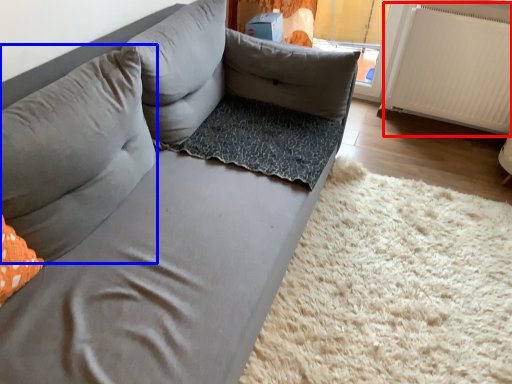
Question: Which of the following is the farthest to the observer, radiator (highlighted by a red box) or pillow (highlighted by a blue box)?

Choices:
 (A) radiator
 (B) pillow

Answer: (A)